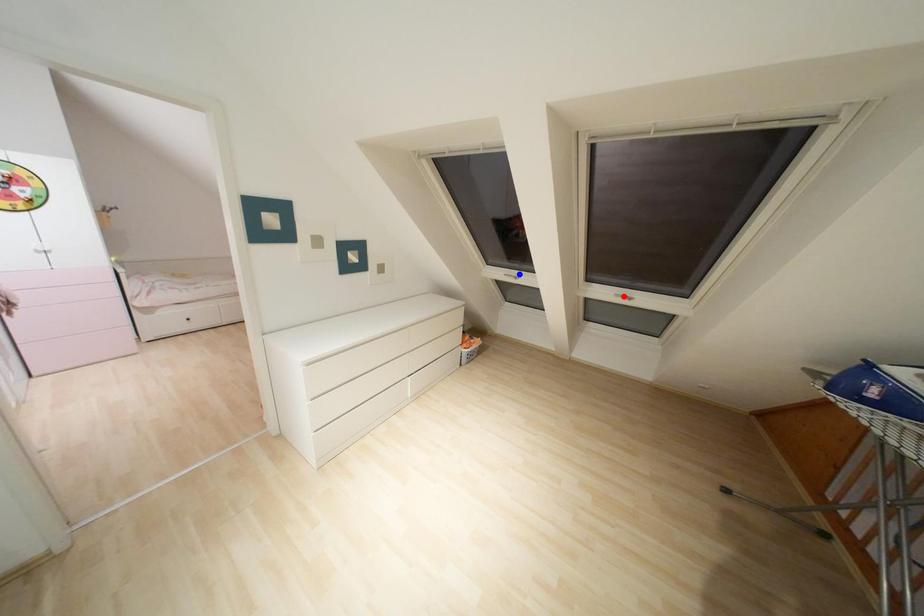
Question: Which of the two points in the image is closer to the camera?

Choices:
 (A) Blue point is closer.
 (B) Red point is closer.

Answer: (B)